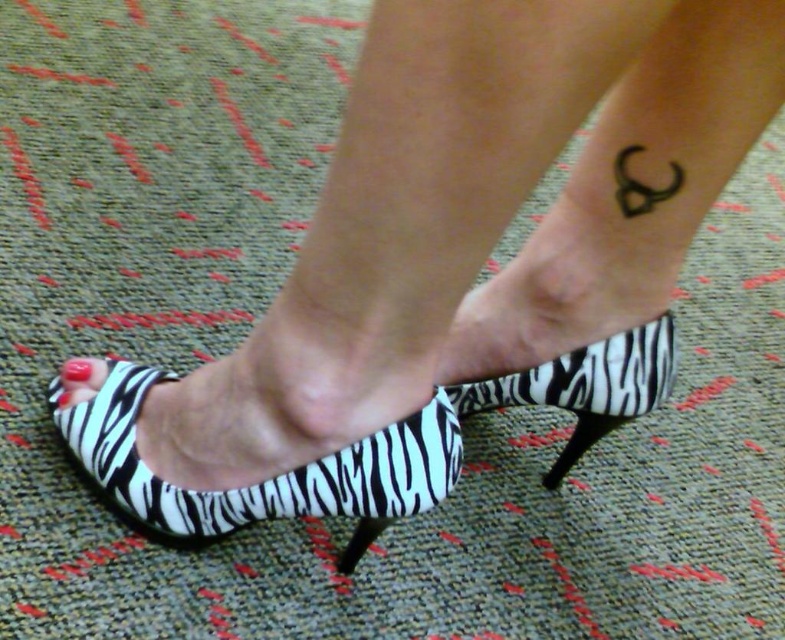
Question: Which point is closer to the camera?

Choices:
 (A) zebra print sandal at center
 (B) black ink tattoo at lower right
 (C) zebra print sandal at lower center
 (D) matte pink nail polish at lower left

Answer: (B)

Question: Which point is closer to the camera?

Choices:
 (A) (110, 392)
 (B) (86, 358)
 (C) (380, 531)

Answer: (C)

Question: Does zebra print sandal at lower center have a smaller size compared to zebra print sandal at center?

Choices:
 (A) yes
 (B) no

Answer: (B)

Question: Which point appears closest to the camera in this image?

Choices:
 (A) (375, 484)
 (B) (367, 540)

Answer: (A)

Question: Does zebra print heel at lower center appear on the right side of matte pink nail polish at lower left?

Choices:
 (A) no
 (B) yes

Answer: (B)

Question: Is glossy red nail at lower left to the left of matte pink nail polish at lower left from the viewer's perspective?

Choices:
 (A) no
 (B) yes

Answer: (A)